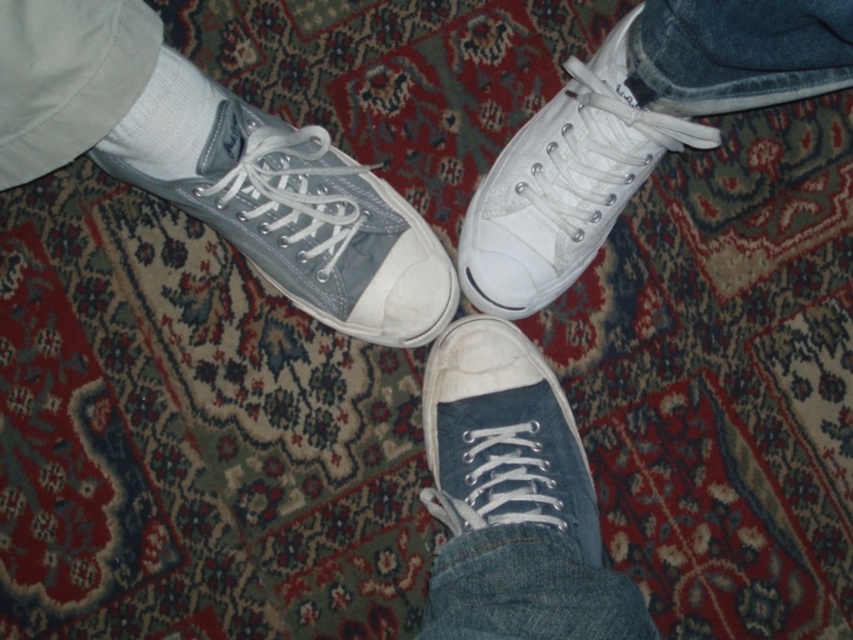
You are a shoe organizer trying to categorize items in a closet. You find a white canvas shoe at lower center and a white cotton sock at upper left. Which item is taller?

The white canvas shoe at lower center is much taller than the white cotton sock at upper left.

You are a delivery robot that is 18 inches wide. You need to move from the white cotton sock at upper left to the white canvas shoe at upper right. Is there enough space for you to pass through the gap between them?

The distance between the white canvas shoe at upper right and the white cotton sock at upper left is 19.71 inches, which is slightly wider than the robot width of 18 inches. Therefore, the robot can pass through the gap between them.